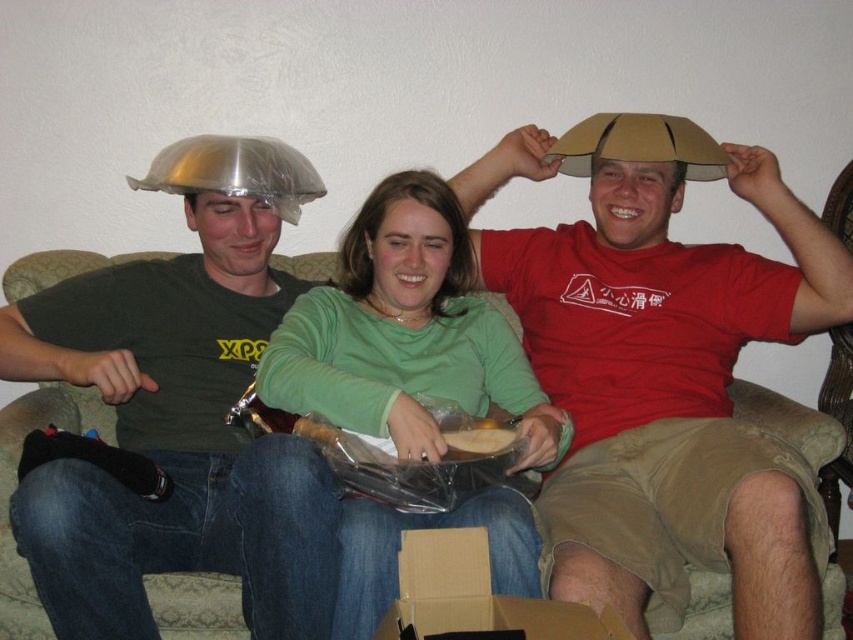
Question: Can you confirm if cardboard box at lower center is positioned below translucent plastic bag at center?

Choices:
 (A) no
 (B) yes

Answer: (B)

Question: Which of the following is the farthest from the observer?

Choices:
 (A) translucent plastic bag at center
 (B) beige fabric couch at center
 (C) matte black shirt at left
 (D) green matte shirt at center

Answer: (B)

Question: Does matte black shirt at left appear over beige fabric couch at center?

Choices:
 (A) yes
 (B) no

Answer: (A)

Question: Is cardboard box at lower center wider than translucent plastic bag at center?

Choices:
 (A) no
 (B) yes

Answer: (B)

Question: Which of the following is the farthest from the observer?

Choices:
 (A) matte black shirt at left
 (B) matte cardboard hat at upper center
 (C) beige fabric couch at center
 (D) cardboard box at lower center

Answer: (C)

Question: Which object is the farthest from the cardboard box at lower center?

Choices:
 (A) green matte shirt at center
 (B) matte black shirt at left
 (C) translucent plastic bag at center

Answer: (B)